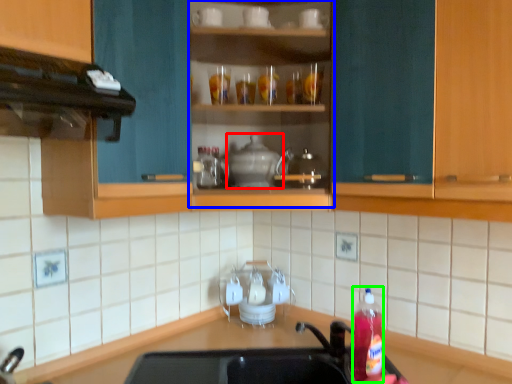
Question: Which object is positioned closest to appliance (highlighted by a red box)? Select from cabinet (highlighted by a blue box) and bottle (highlighted by a green box).

Choices:
 (A) cabinet
 (B) bottle

Answer: (A)